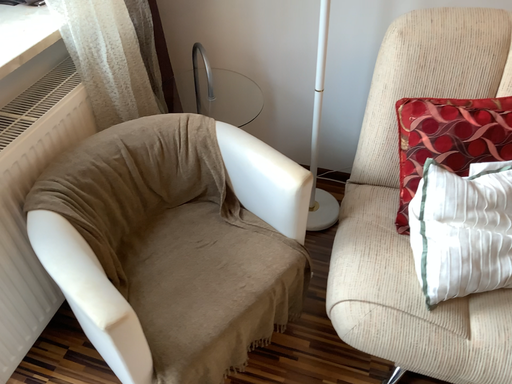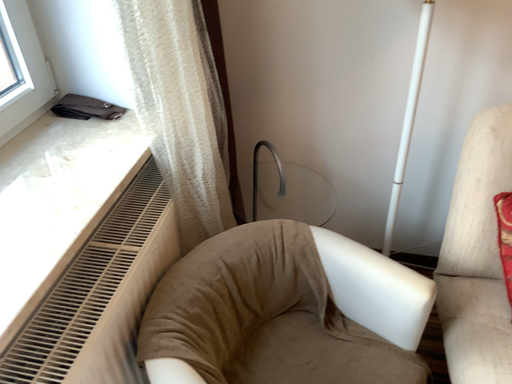
Question: How did the camera likely rotate when shooting the video?

Choices:
 (A) rotated upward
 (B) rotated downward

Answer: (A)